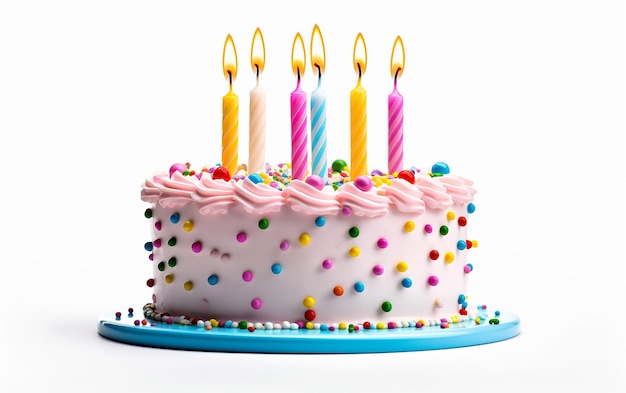
What are the coordinates of `candle wicks` in the screenshot? It's located at (232, 80), (258, 76), (298, 78), (317, 77), (357, 79), (394, 84).